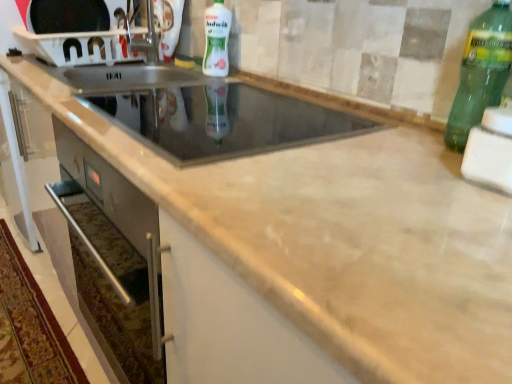
Question: Considering the positions of point (503, 173) and point (220, 3), is point (503, 173) closer or farther from the camera than point (220, 3)?

Choices:
 (A) farther
 (B) closer

Answer: (B)

Question: From the image's perspective, is white foam sponge at right, the third appliance from the left, above or below white glossy bottle at upper center, the first bottle viewed from the left?

Choices:
 (A) above
 (B) below

Answer: (B)

Question: Considering the real-world distances, which object is closest to the white glossy bottle at upper center, positioned as the second bottle in right-to-left order?

Choices:
 (A) glass stovetop at center, which is the second appliance in bottom-to-top order
 (B) white plastic microwave at upper left, placed as the first appliance when sorted from top to bottom
 (C) white foam sponge at right, positioned as the 1th appliance in bottom-to-top order
 (D) green glass bottle at right, the 2th bottle in the top-to-bottom sequence

Answer: (B)

Question: Estimate the real-world distances between objects in this image. Which object is farther from the white plastic microwave at upper left, which ranks as the third appliance in right-to-left order?

Choices:
 (A) glass stovetop at center, which is the second appliance in bottom-to-top order
 (B) green glass bottle at right, the 2th bottle in the top-to-bottom sequence
 (C) white foam sponge at right, which appears as the third appliance when viewed from the back
 (D) white glossy bottle at upper center, positioned as the second bottle in right-to-left order

Answer: (C)